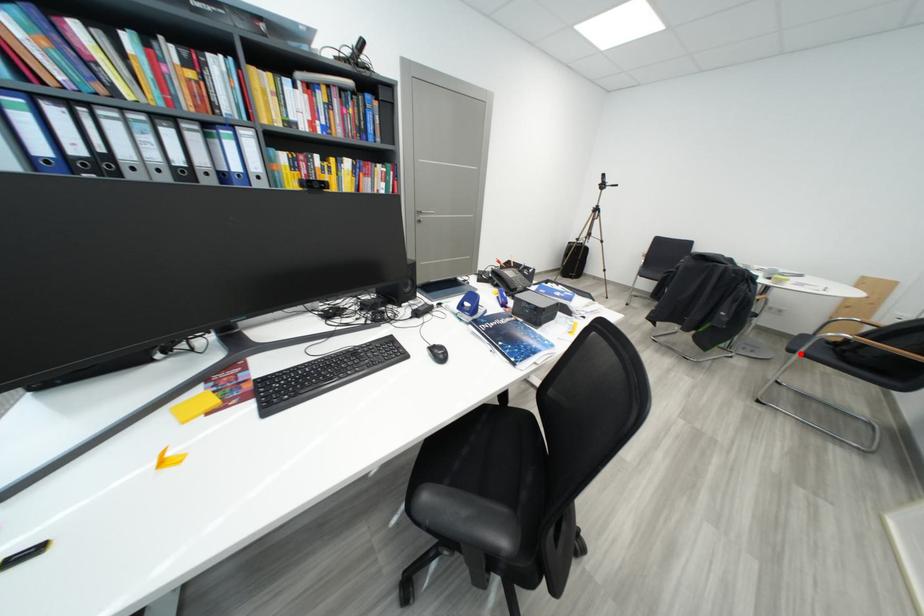
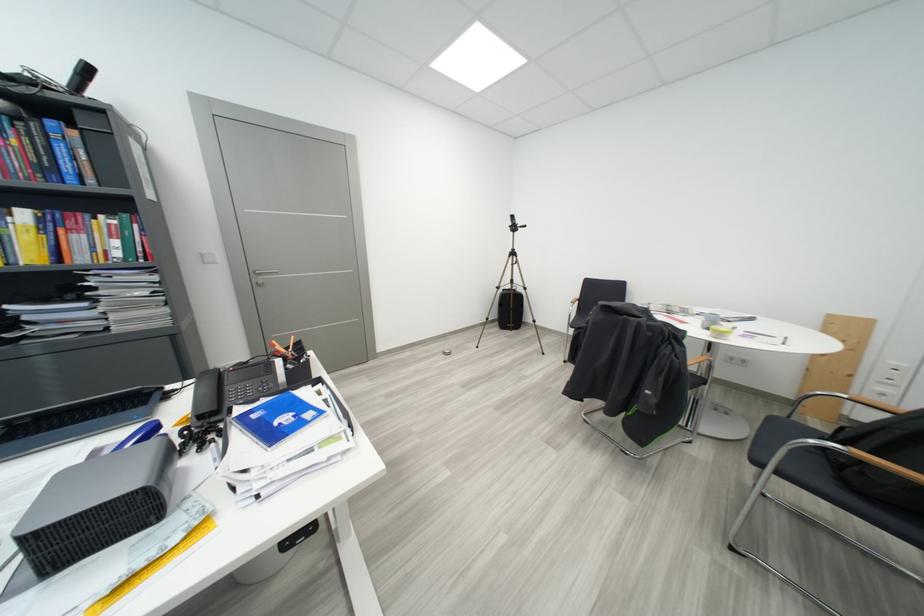
Find the pixel in the second image that matches the highlighted location in the first image.

(767, 466)